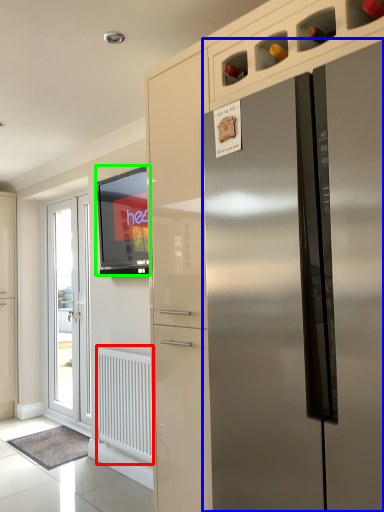
Question: Based on their relative distances, which object is nearer to radiator (highlighted by a red box)? Choose from refrigerator (highlighted by a blue box) and window screen (highlighted by a green box).

Choices:
 (A) refrigerator
 (B) window screen

Answer: (B)